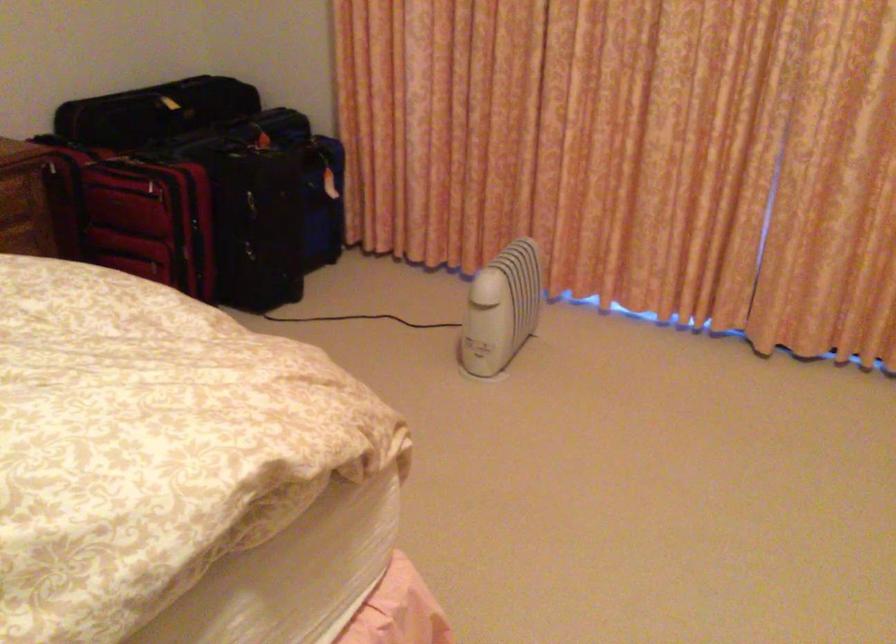
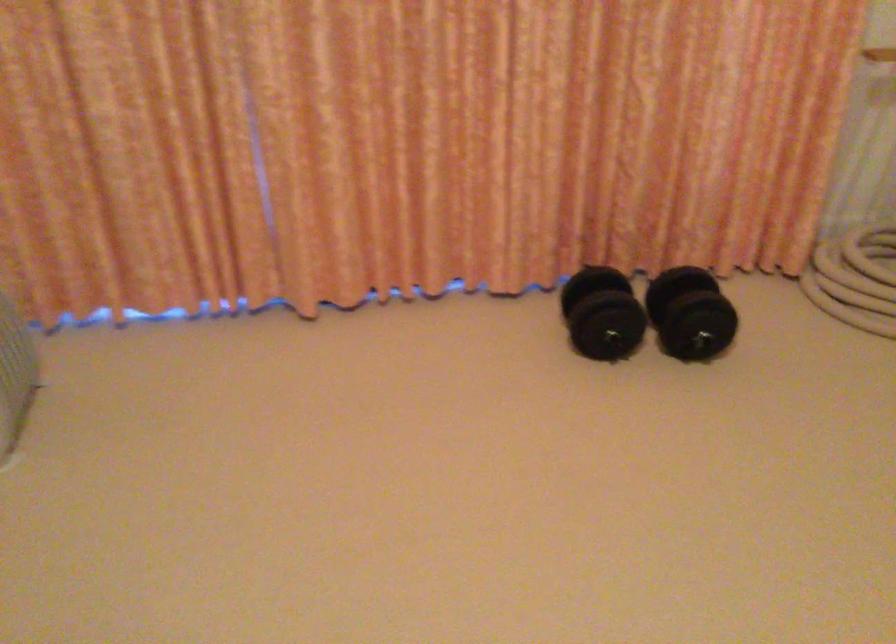
Question: The camera is either moving clockwise (left) or counter-clockwise (right) around the object. The first image is from the beginning of the video and the second image is from the end. Is the camera moving left or right when shooting the video?

Choices:
 (A) Left
 (B) Right

Answer: (A)